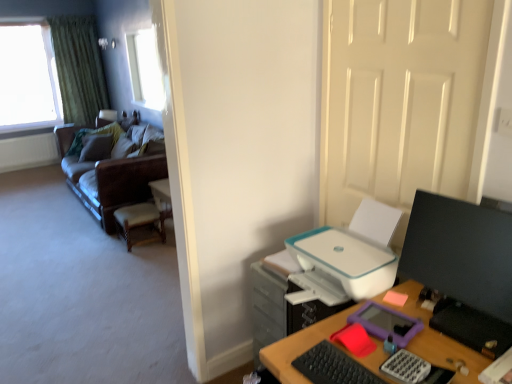
Find the location of a particular element. free space above wooden woven seat at left (from a real-world perspective) is located at coordinates (138, 212).